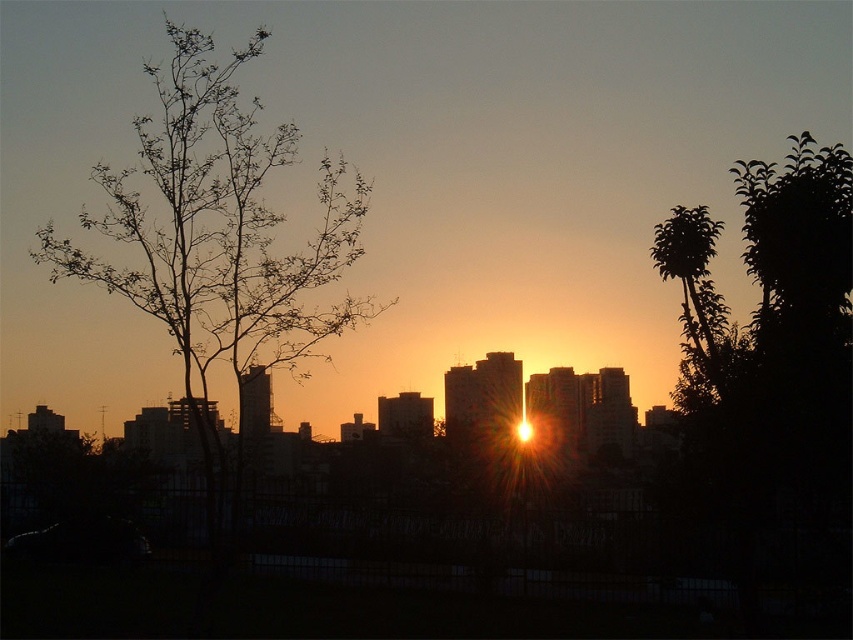
You are an artist sketching the urban sunset scene. You want to draw the bare branches at left and green leafy tree at right with proper perspective. Which one should you draw first to maintain depth perception?

You should draw the bare branches at left first since it is closer to the viewer than the green leafy tree at right, allowing you to layer the background elements correctly.

You are an artist sketching this scene. You want to draw the trees accurately. Which tree should you draw larger, the bare branches at left or the green leafy tree at right?

The bare branches at left should be drawn larger since it is larger in size than the green leafy tree at right.